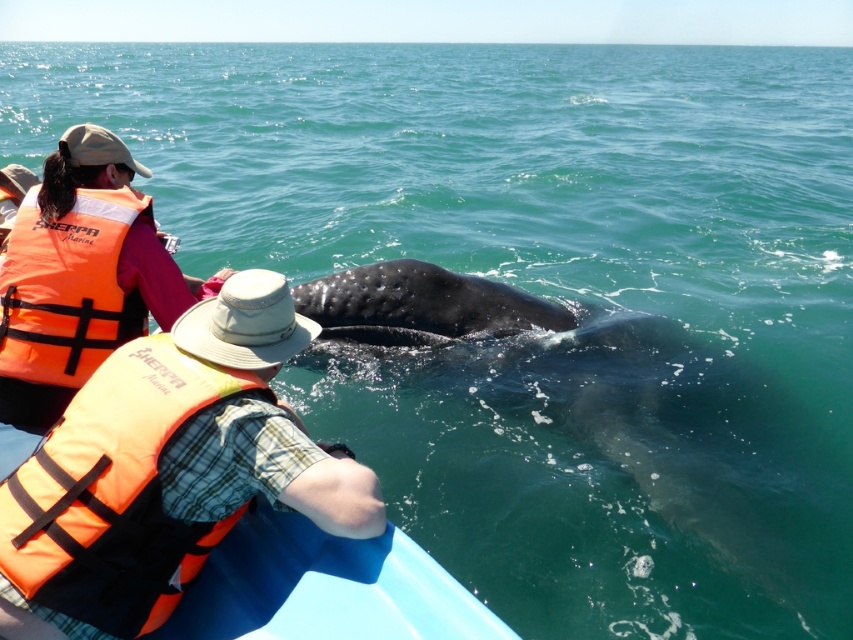
You are a photographer trying to capture the whale in the center of your photo. You notice two points marked on your screen at coordinates point (151,525) and point (70,323). Which point should you focus on to ensure the whale is sharp in your image?

You should focus on point (151,525) because it is closer to the camera than point (70,323), ensuring the whale will be in focus.

Looking at this image, you are on a boat and need to choose a life jacket for a child. The orange fabric life jacket at lower left and the orange life jacket at left are available. Which one is more suitable for a child?

The orange life jacket at left is more suitable for a child because it is smaller in size compared to the orange fabric life jacket at lower left.

You are on a boat and need to choose a life jacket that is taller. Which one should you pick between the orange fabric life jacket at lower left and the orange life jacket at left?

The orange fabric life jacket at lower left is taller than the orange life jacket at left, so you should pick the orange fabric life jacket at lower left.